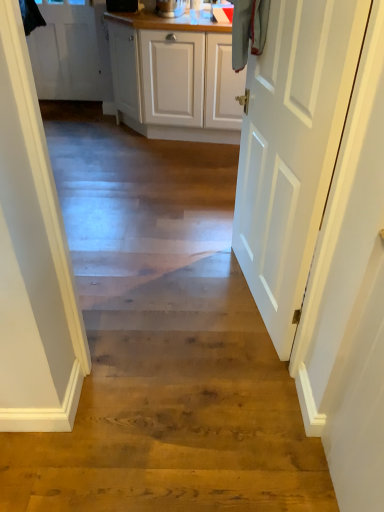
Identify the location of vacant space positioned to the left of white matte door at right, which is the 1th door in right-to-left order. (177, 310).